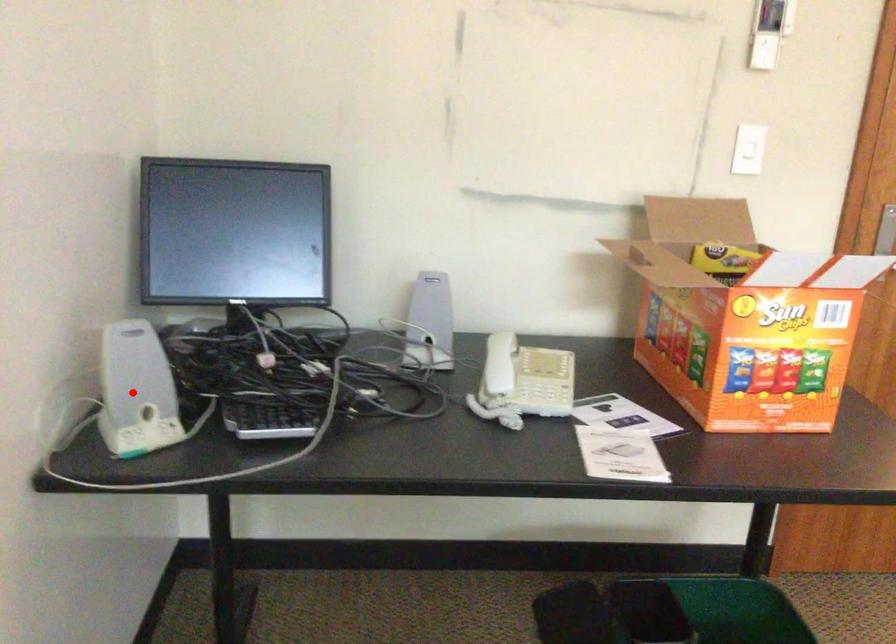
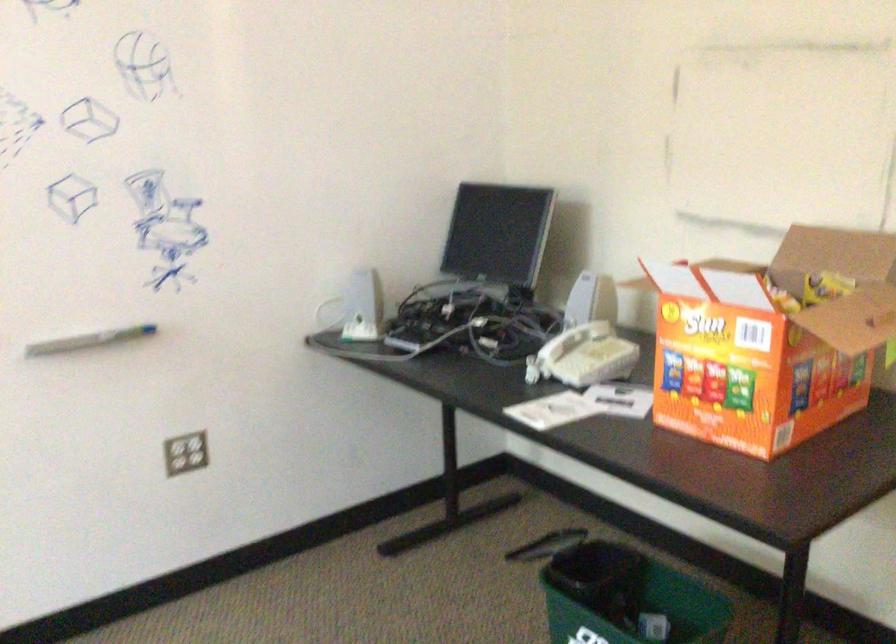
Question: I am providing you with two images of the same scene from different viewpoints. Image1 has a red point marked. In image2, the corresponding 3D location appears at what relative position? Reply with the corresponding letter.

Choices:
 (A) Closer
 (B) Farther

Answer: (B)